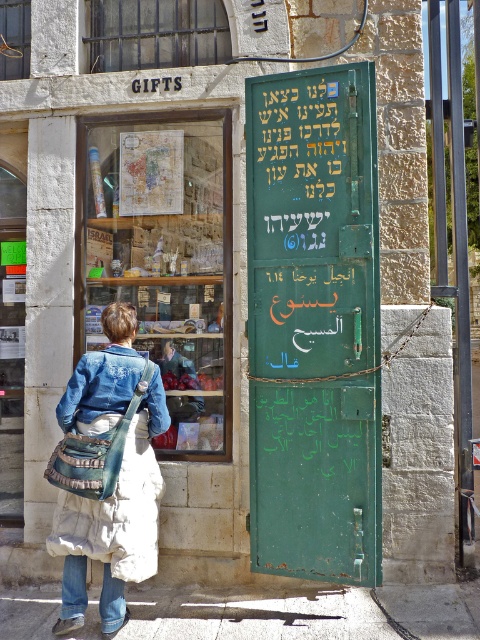
Question: Is green matte signboard at center smaller than denim jacket at lower left?

Choices:
 (A) no
 (B) yes

Answer: (A)

Question: Which of the following is the farthest from the observer?

Choices:
 (A) (292, 435)
 (B) (85, 396)

Answer: (B)

Question: Is green matte signboard at center bigger than denim jacket at lower left?

Choices:
 (A) yes
 (B) no

Answer: (A)

Question: Is denim jacket at lower right positioned behind denim jeans at lower left?

Choices:
 (A) yes
 (B) no

Answer: (B)

Question: Among these points, which one is farthest from the camera?

Choices:
 (A) (86, 420)
 (B) (141, 372)
 (C) (267, 205)
 (D) (104, 611)

Answer: (C)

Question: Which point is closer to the camera taking this photo?

Choices:
 (A) (70, 589)
 (B) (379, 566)

Answer: (B)